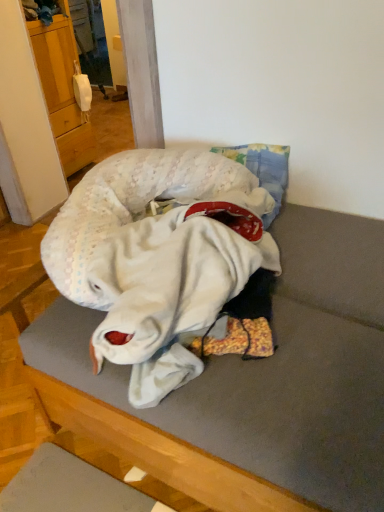
Question: Can you confirm if white fabric pillow at center is wider than wooden cabinet at left?

Choices:
 (A) no
 (B) yes

Answer: (B)

Question: From the image's perspective, would you say white fabric pillow at center is positioned over wooden cabinet at left?

Choices:
 (A) no
 (B) yes

Answer: (A)

Question: Can you confirm if white fabric pillow at center is smaller than wooden cabinet at left?

Choices:
 (A) no
 (B) yes

Answer: (A)

Question: From a real-world perspective, is white fabric pillow at center located higher than wooden cabinet at left?

Choices:
 (A) no
 (B) yes

Answer: (A)

Question: Considering the relative sizes of white fabric pillow at center and wooden cabinet at left in the image provided, is white fabric pillow at center bigger than wooden cabinet at left?

Choices:
 (A) yes
 (B) no

Answer: (A)

Question: Would you say white fabric pillow at center contains wooden cabinet at left?

Choices:
 (A) yes
 (B) no

Answer: (B)

Question: Considering the relative sizes of white knitted baby at center and white fabric pillow at center in the image provided, is white knitted baby at center thinner than white fabric pillow at center?

Choices:
 (A) no
 (B) yes

Answer: (B)

Question: Is white knitted baby at center taller than white fabric pillow at center?

Choices:
 (A) no
 (B) yes

Answer: (A)

Question: From a real-world perspective, is white knitted baby at center physically above white fabric pillow at center?

Choices:
 (A) yes
 (B) no

Answer: (A)

Question: Could white fabric pillow at center be considered to be inside white knitted baby at center?

Choices:
 (A) no
 (B) yes

Answer: (A)

Question: From the image's perspective, would you say white knitted baby at center is positioned over white fabric pillow at center?

Choices:
 (A) yes
 (B) no

Answer: (A)

Question: Is white knitted baby at center positioned far away from white fabric pillow at center?

Choices:
 (A) yes
 (B) no

Answer: (B)

Question: From the image's perspective, is wooden cabinet at left over white knitted baby at center?

Choices:
 (A) no
 (B) yes

Answer: (B)